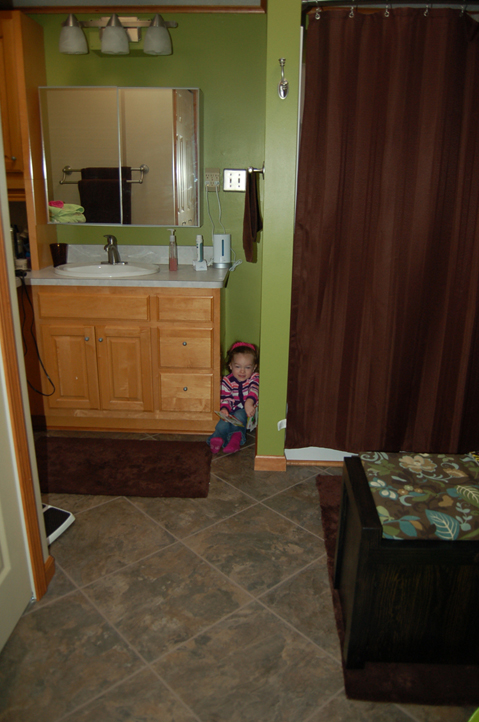
Locate an element on the screen. 3 towels is located at coordinates [x=252, y=219], [x=91, y=206], [x=108, y=170].